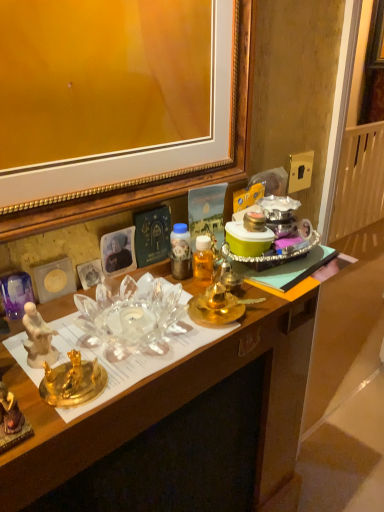
Question: Considering the relative positions of white porcelain plate at left and gold metallic power outlet at upper right in the image provided, is white porcelain plate at left to the left of gold metallic power outlet at upper right from the viewer's perspective?

Choices:
 (A) no
 (B) yes

Answer: (B)

Question: Can you confirm if white porcelain plate at left is taller than gold metallic power outlet at upper right?

Choices:
 (A) no
 (B) yes

Answer: (B)

Question: From the image's perspective, is white porcelain plate at left beneath gold metallic power outlet at upper right?

Choices:
 (A) yes
 (B) no

Answer: (A)

Question: Does white porcelain plate at left have a greater width compared to gold metallic power outlet at upper right?

Choices:
 (A) no
 (B) yes

Answer: (B)

Question: Are white porcelain plate at left and gold metallic power outlet at upper right located far from each other?

Choices:
 (A) yes
 (B) no

Answer: (B)

Question: From a real-world perspective, is white porcelain plate at left physically located above or below gold metallic power outlet at upper right?

Choices:
 (A) above
 (B) below

Answer: (B)

Question: From the image's perspective, is white porcelain plate at left above or below gold metallic power outlet at upper right?

Choices:
 (A) below
 (B) above

Answer: (A)

Question: Considering the relative positions of white porcelain plate at left and gold metallic power outlet at upper right in the image provided, is white porcelain plate at left to the left or to the right of gold metallic power outlet at upper right?

Choices:
 (A) left
 (B) right

Answer: (A)

Question: Is white porcelain plate at left in front of or behind gold metallic power outlet at upper right in the image?

Choices:
 (A) front
 (B) behind

Answer: (A)

Question: Considering the positions of white porcelain plate at left and transparent glass bowl at center in the image, is white porcelain plate at left wider or thinner than transparent glass bowl at center?

Choices:
 (A) wide
 (B) thin

Answer: (B)

Question: Do you think white porcelain plate at left is within transparent glass bowl at center, or outside of it?

Choices:
 (A) inside
 (B) outside

Answer: (B)

Question: Is white porcelain plate at left bigger or smaller than transparent glass bowl at center?

Choices:
 (A) big
 (B) small

Answer: (B)

Question: Is white porcelain plate at left in front of or behind transparent glass bowl at center in the image?

Choices:
 (A) front
 (B) behind

Answer: (B)

Question: Is gold metallic power outlet at upper right spatially inside transparent glass bowl at center, or outside of it?

Choices:
 (A) inside
 (B) outside

Answer: (B)

Question: Does point (299, 185) appear closer or farther from the camera than point (52, 480)?

Choices:
 (A) farther
 (B) closer

Answer: (A)